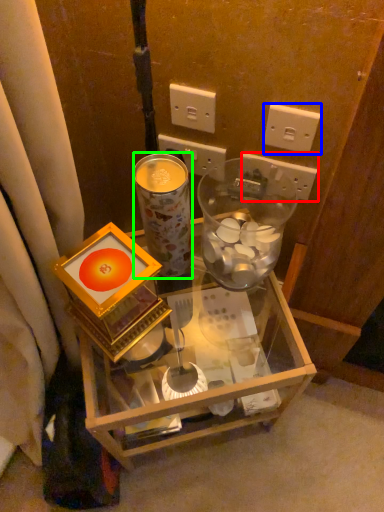
Question: Which object is the closest to the power outlet (highlighted by a red box)? Choose among these: power outlet (highlighted by a blue box) or coffee cup (highlighted by a green box).

Choices:
 (A) power outlet
 (B) coffee cup

Answer: (A)